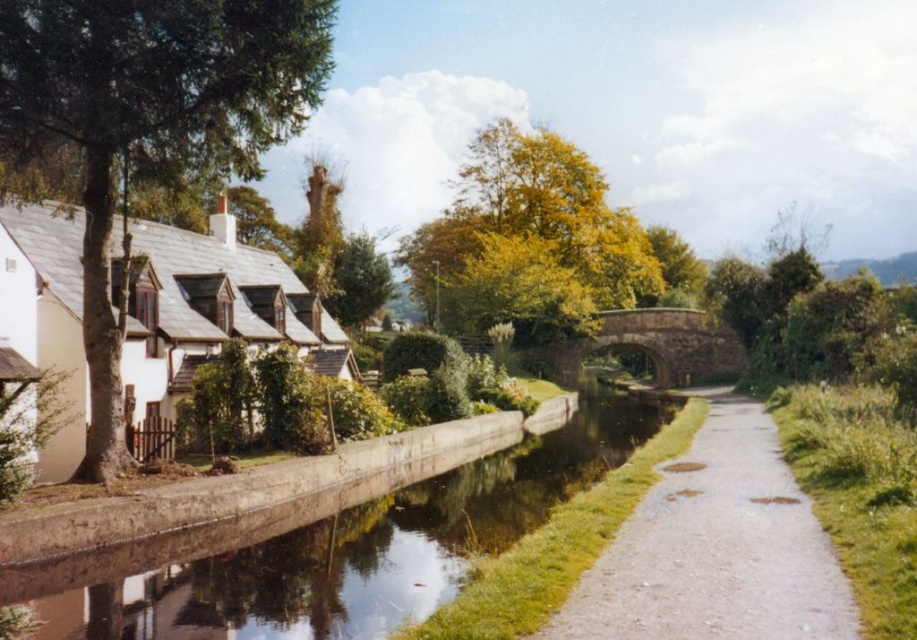
Between point (749, 477) and point (264, 314), which one is positioned behind?

Positioned behind is point (264, 314).

Is gravelly gray path at center thinner than white matte cottage at left?

No, gravelly gray path at center is not thinner than white matte cottage at left.

Is point (667, 628) more distant than point (294, 289)?

That is False.

This screenshot has height=640, width=917. What are the coordinates of `gravelly gray path at center` in the screenshot? It's located at (715, 548).

Who is positioned more to the right, smooth concrete canal at center or gravelly gray path at center?

From the viewer's perspective, gravelly gray path at center appears more on the right side.

The height and width of the screenshot is (640, 917). What do you see at coordinates (337, 545) in the screenshot?
I see `smooth concrete canal at center` at bounding box center [337, 545].

The image size is (917, 640). Describe the element at coordinates (337, 545) in the screenshot. I see `smooth concrete canal at center` at that location.

Find the location of `smooth concrete canal at center`. smooth concrete canal at center is located at coordinates (337, 545).

Looking at this image, how much distance is there between smooth concrete canal at center and stone arch bridge at center?

They are 22.11 meters apart.

Who is taller, smooth concrete canal at center or stone arch bridge at center?

Standing taller between the two is stone arch bridge at center.

What do you see at coordinates (337, 545) in the screenshot? The height and width of the screenshot is (640, 917). I see `smooth concrete canal at center` at bounding box center [337, 545].

You are a GUI agent. You are given a task and a screenshot of the screen. Output one action in this format:
    pyautogui.click(x=<x>, y=<y>)
    Task: Click on the smooth concrete canal at center
    The height and width of the screenshot is (640, 917).
    Given the screenshot: What is the action you would take?
    pyautogui.click(x=337, y=545)